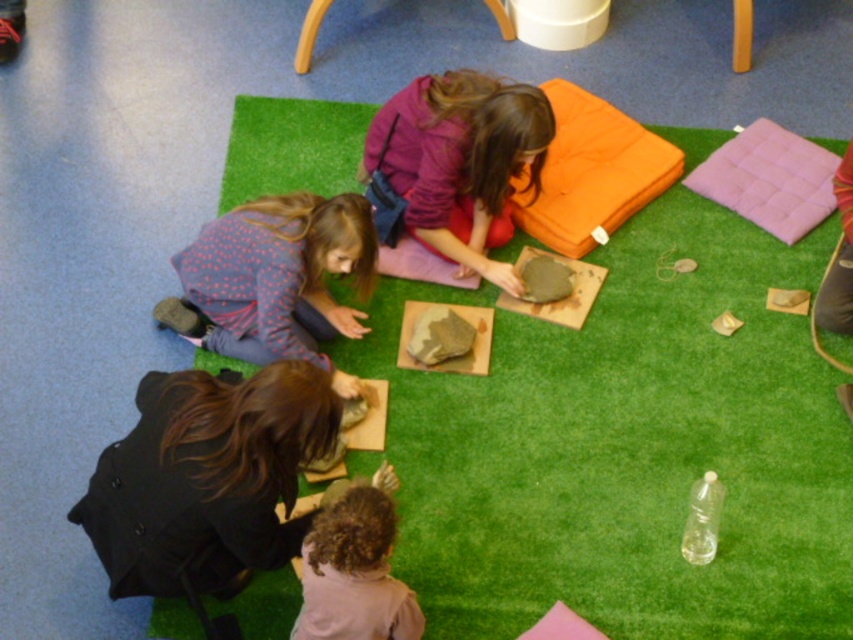
Is orange fabric cushion at upper center behind pink fabric cushion at upper right?

No, it is in front of pink fabric cushion at upper right.

Who is positioned more to the left, orange fabric cushion at upper center or pink fabric cushion at upper right?

Positioned to the left is orange fabric cushion at upper center.

Where is `orange fabric cushion at upper center`? The height and width of the screenshot is (640, 853). orange fabric cushion at upper center is located at coordinates (592, 172).

Where is `orange fabric cushion at upper center`? The image size is (853, 640). orange fabric cushion at upper center is located at coordinates (592, 172).

Does matte purple sweater at center have a lesser width compared to pink fabric cushion at upper right?

No.

Is point (381, 163) closer to viewer compared to point (744, 138)?

Yes.

Who is more forward, (467,188) or (784,224)?

Point (467,188) is in front.

I want to click on matte purple sweater at center, so click(453, 173).

Consider the image. Which of these two, matte purple sweater at center or rough stone at center, stands shorter?

rough stone at center is shorter.

From the picture: Can you confirm if matte purple sweater at center is positioned above rough stone at center?

Indeed, matte purple sweater at center is positioned over rough stone at center.

Between point (422, 96) and point (468, 342), which one is positioned behind?

Positioned behind is point (468, 342).

You are a GUI agent. You are given a task and a screenshot of the screen. Output one action in this format:
    pyautogui.click(x=<x>, y=<y>)
    Task: Click on the matte purple sweater at center
    
    Given the screenshot: What is the action you would take?
    [453, 173]